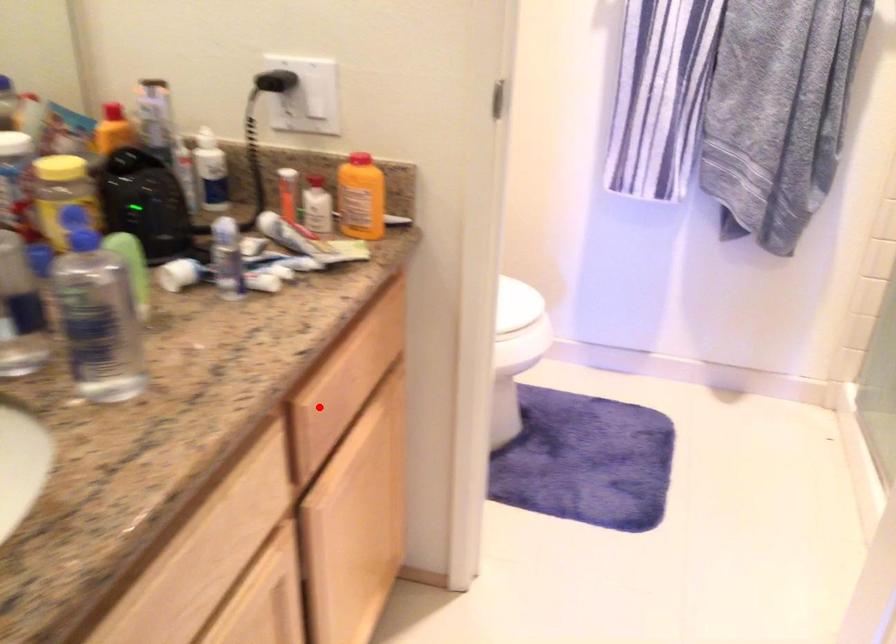
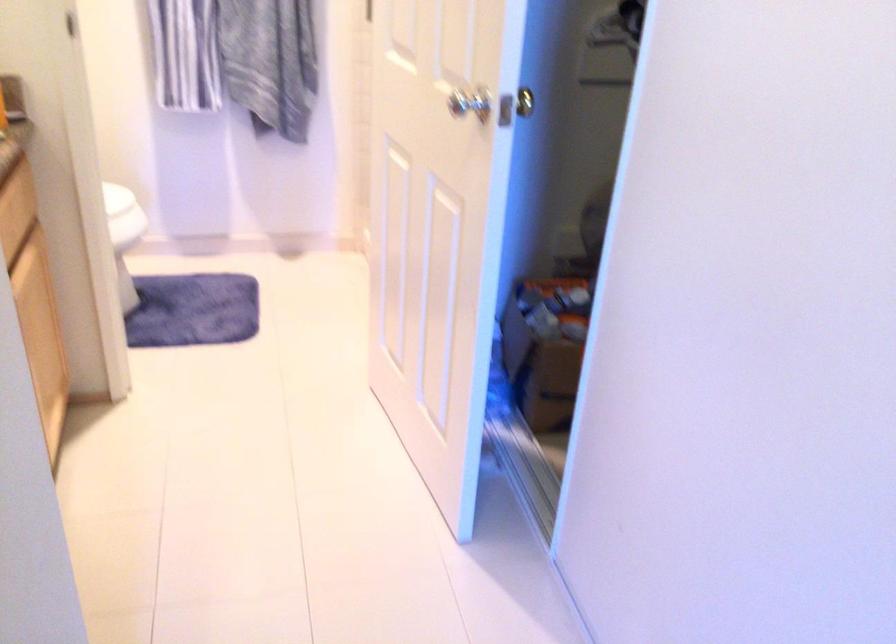
Where in the second image is the point corresponding to the highlighted location from the first image?

(12, 229)